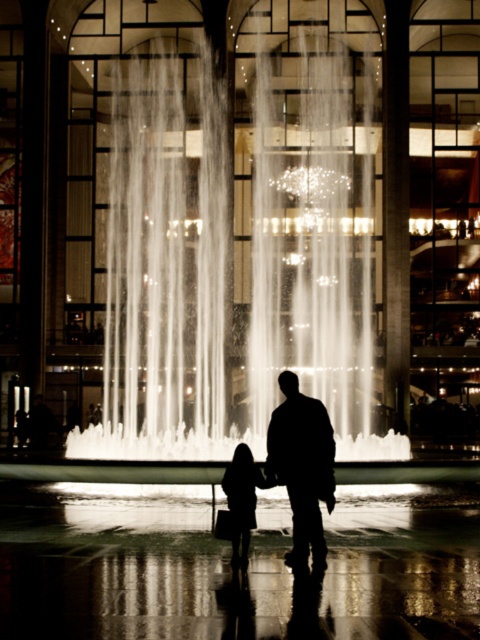
Question: Does silhouette fabric at center appear over silhouette dress at center?

Choices:
 (A) no
 (B) yes

Answer: (B)

Question: Among these points, which one is farthest from the camera?

Choices:
 (A) (235, 522)
 (B) (282, 477)

Answer: (B)

Question: Does silhouette fabric at center appear under silhouette dress at center?

Choices:
 (A) yes
 (B) no

Answer: (B)

Question: Does silhouette fabric at center appear on the left side of silhouette dress at center?

Choices:
 (A) no
 (B) yes

Answer: (A)

Question: Which object is farther from the camera taking this photo?

Choices:
 (A) silhouette dress at center
 (B) silhouette fabric at center

Answer: (B)